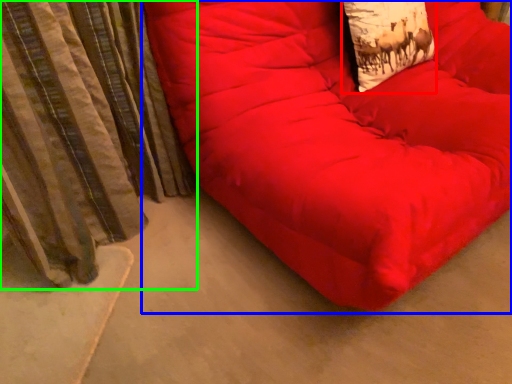
Question: Which object is the farthest from throw pillow (highlighted by a red box)? Choose among these: furniture (highlighted by a blue box) or curtain (highlighted by a green box).

Choices:
 (A) furniture
 (B) curtain

Answer: (B)